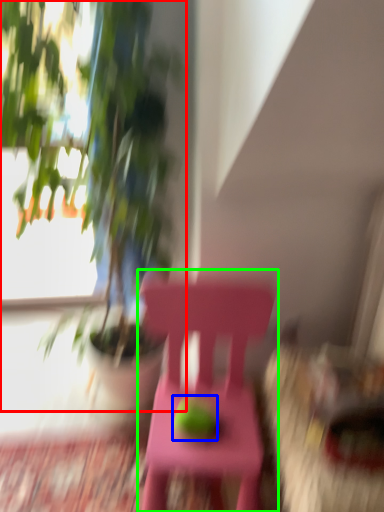
Question: Which object is positioned closest to houseplant (highlighted by a red box)? Select from fruit (highlighted by a blue box) and chair (highlighted by a green box).

Choices:
 (A) fruit
 (B) chair

Answer: (B)